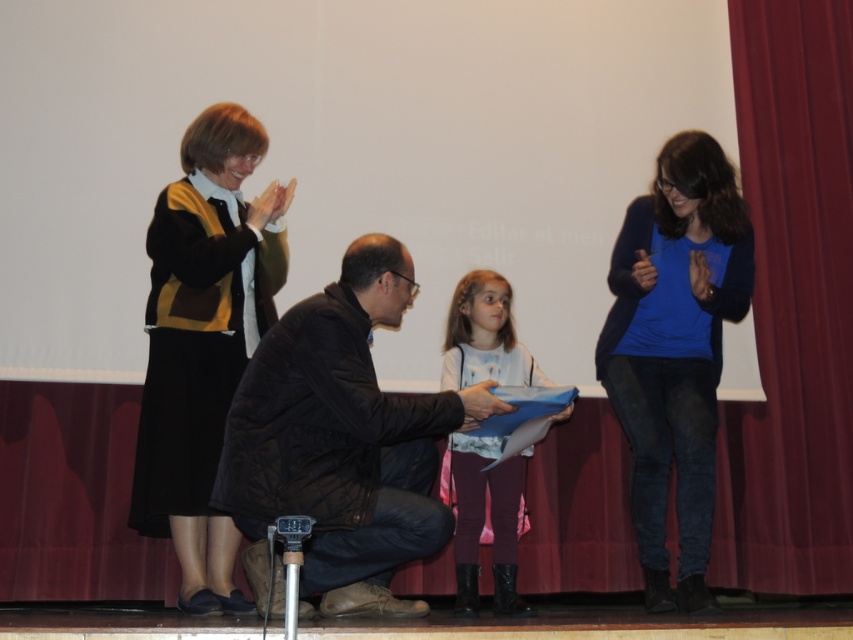
You are directing a play and need to adjust the actors based on their clothing. The dark brown leather jacket at center and the blue cotton shirt at right are part of the scene. Which clothing item is positioned lower on the stage?

The dark brown leather jacket at center is positioned lower on the stage than the blue cotton shirt at right.

You are standing on the stage and want to move from the location of point (397, 273) to point (492, 481). Is there a clear path between them without obstacles?

Yes, since point (397, 273) is in front of point (492, 481), there is a clear path between them without obstacles.